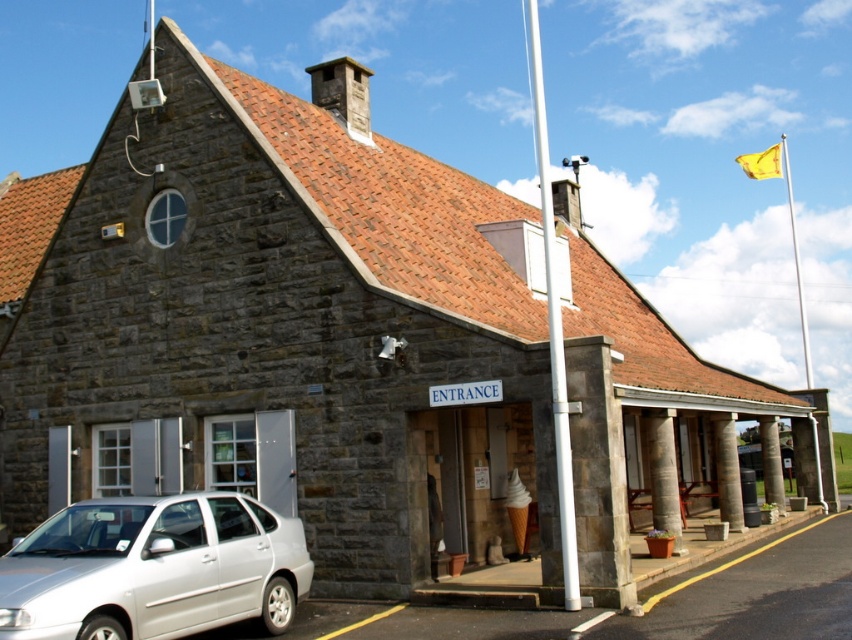
Question: Is white metallic flag pole at center positioned at the back of yellow fabric flagpole at upper right?

Choices:
 (A) yes
 (B) no

Answer: (B)

Question: In this image, where is yellow fabric flagpole at upper right located relative to brown stone pillar at lower right?

Choices:
 (A) left
 (B) right

Answer: (B)

Question: Can you confirm if silver metallic car at lower left is bigger than yellow fabric flag at upper right?

Choices:
 (A) no
 (B) yes

Answer: (A)

Question: Which point appears closest to the camera in this image?

Choices:
 (A) (540, 196)
 (B) (717, 468)
 (C) (744, 168)

Answer: (B)

Question: Estimate the real-world distances between objects in this image. Which object is farther from the white metallic flag pole at center?

Choices:
 (A) yellow fabric flag at upper right
 (B) brown stone pillar at lower right
 (C) silver metallic car at lower left

Answer: (C)

Question: Which object appears farthest from the camera in this image?

Choices:
 (A) brown stone pillar at lower right
 (B) yellow fabric flag at upper right
 (C) smooth stone column at center

Answer: (B)